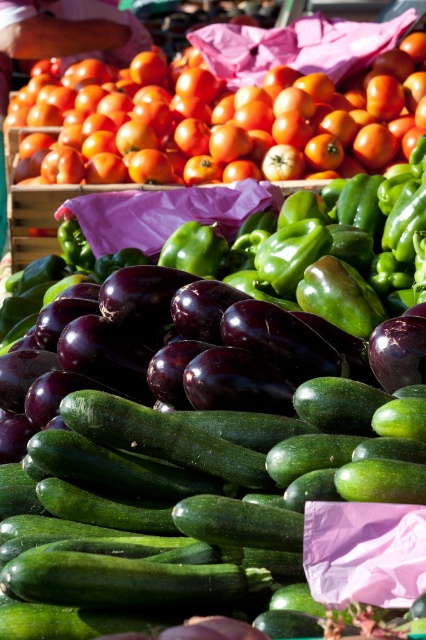
You are a customer at a market stall. You see the green smooth cucumber at center and the shiny orange tomato at upper left. Which one is shorter in height?

The green smooth cucumber at center is not as tall as the shiny orange tomato at upper left, so the green smooth cucumber at center is shorter in height.

You are a customer at the market stall. You want to pick up the green smooth cucumber at center and the shiny orange tomato at upper left. Which one is located to the right of the other?

The green smooth cucumber at center is to the right of the shiny orange tomato at upper left.